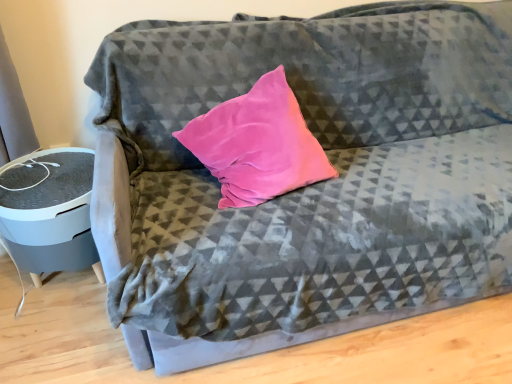
Where is `matte gray table at left`? The height and width of the screenshot is (384, 512). matte gray table at left is located at coordinates (49, 212).

Describe the element at coordinates (49, 212) in the screenshot. This screenshot has height=384, width=512. I see `matte gray table at left` at that location.

Locate an element on the screen. This screenshot has width=512, height=384. matte gray table at left is located at coordinates (49, 212).